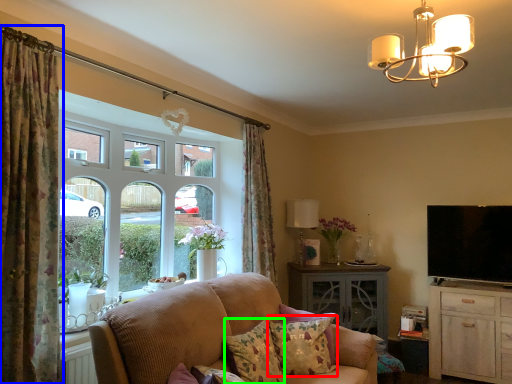
Question: Which object is positioned farthest from pillow (highlighted by a red box)? Select from curtain (highlighted by a blue box) and pillow (highlighted by a green box).

Choices:
 (A) curtain
 (B) pillow

Answer: (A)